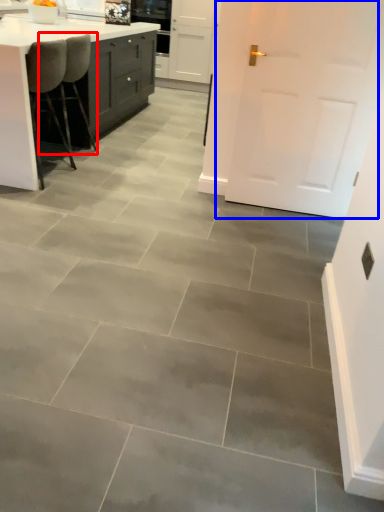
Question: Which object is further to the camera taking this photo, chair (highlighted by a red box) or door (highlighted by a blue box)?

Choices:
 (A) chair
 (B) door

Answer: (A)